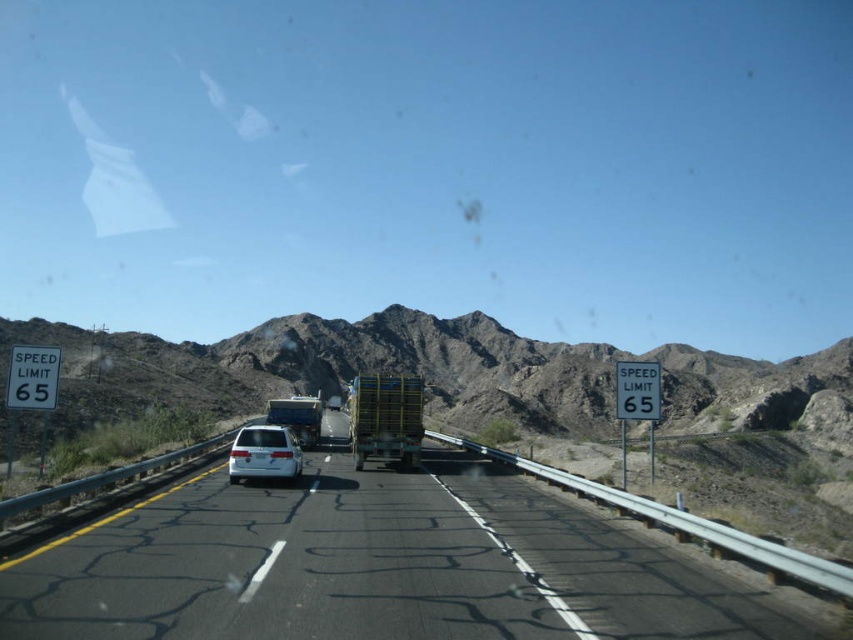
You are driving a car and see the brown rocky mountain at center and the brushed metal trailer truck at center ahead. Which one appears wider from your perspective?

The brown rocky mountain at center appears wider than the brushed metal trailer truck at center because its width is larger than the truck.

You are driving on a highway and see the black asphalt highway at center and the brown rocky mountain at center. Which one is closer to you?

The black asphalt highway at center is closer because it is in front of the brown rocky mountain at center.